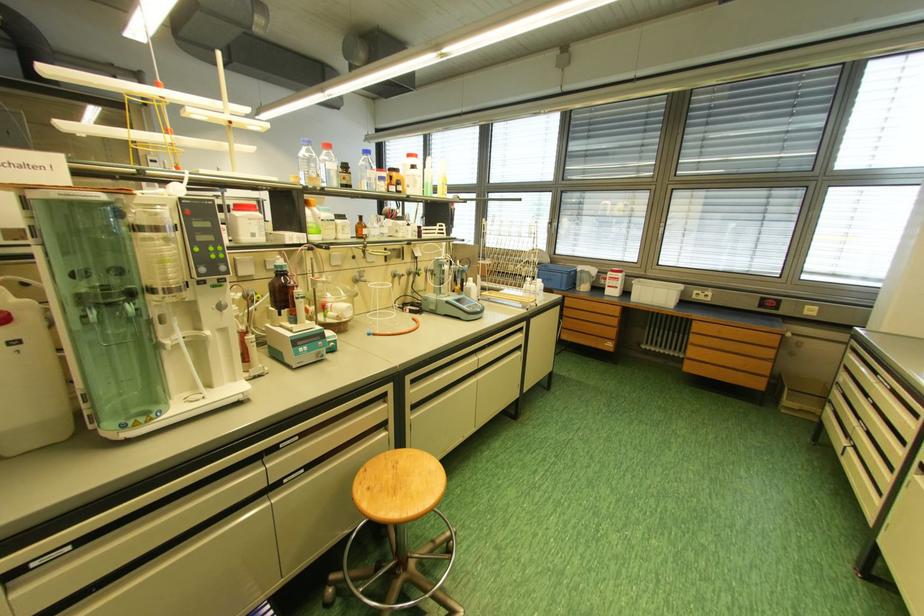
The image size is (924, 616). Identify the location of glass desiccator lid. (87, 249).